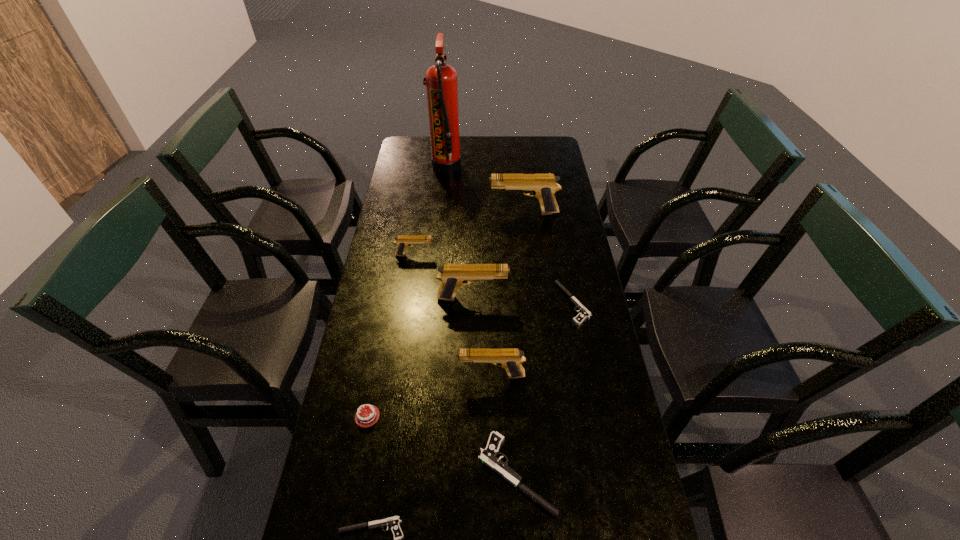
The image size is (960, 540). What are the coordinates of `the farthest object` in the screenshot? It's located at (441, 83).

Where is `the tallest object`? This screenshot has height=540, width=960. the tallest object is located at coordinates [x=441, y=83].

Identify the location of the eighth shortest object. Image resolution: width=960 pixels, height=540 pixels. (543, 186).

Identify the location of the farthest pistol. The height and width of the screenshot is (540, 960). (543, 186).

Locate an element on the screen. The width and height of the screenshot is (960, 540). the third tallest object is located at coordinates click(x=453, y=276).

Where is `the third farthest tan pistol`? This screenshot has width=960, height=540. the third farthest tan pistol is located at coordinates (453, 276).

Find the location of `the third biggest tan pistol`. the third biggest tan pistol is located at coordinates (510, 359).

Locate an element on the screen. the fourth nearest object is located at coordinates (510, 359).

This screenshot has height=540, width=960. I want to click on the fifth shortest object, so click(x=402, y=241).

Locate an element on the screen. The height and width of the screenshot is (540, 960). the smallest tan pistol is located at coordinates (402, 241).